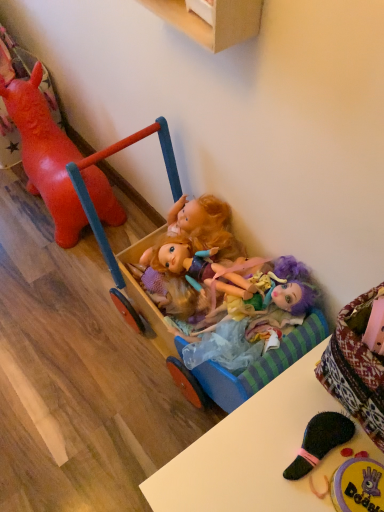
Question: From the image's perspective, is multicolored fabric dolls at center under wooden cabinet at upper center?

Choices:
 (A) yes
 (B) no

Answer: (A)

Question: Can you confirm if multicolored fabric dolls at center is thinner than wooden cabinet at upper center?

Choices:
 (A) yes
 (B) no

Answer: (B)

Question: Can you confirm if multicolored fabric dolls at center is bigger than wooden cabinet at upper center?

Choices:
 (A) no
 (B) yes

Answer: (A)

Question: Is multicolored fabric dolls at center facing away from wooden cabinet at upper center?

Choices:
 (A) no
 (B) yes

Answer: (A)

Question: Is multicolored fabric dolls at center far away from wooden cabinet at upper center?

Choices:
 (A) yes
 (B) no

Answer: (B)

Question: Considering the positions of wooden cabinet at upper center and multicolored fabric dolls at center in the image, is wooden cabinet at upper center taller or shorter than multicolored fabric dolls at center?

Choices:
 (A) short
 (B) tall

Answer: (B)

Question: Do you think wooden cabinet at upper center is within multicolored fabric dolls at center, or outside of it?

Choices:
 (A) inside
 (B) outside

Answer: (B)

Question: Is wooden cabinet at upper center bigger or smaller than multicolored fabric dolls at center?

Choices:
 (A) big
 (B) small

Answer: (A)

Question: Considering the positions of wooden cabinet at upper center and multicolored fabric dolls at center in the image, is wooden cabinet at upper center wider or thinner than multicolored fabric dolls at center?

Choices:
 (A) thin
 (B) wide

Answer: (A)

Question: From the image's perspective, relative to wooden toy carriage at center, is multicolored fabric dolls at center above or below?

Choices:
 (A) above
 (B) below

Answer: (B)

Question: Considering the positions of multicolored fabric dolls at center and wooden toy carriage at center in the image, is multicolored fabric dolls at center wider or thinner than wooden toy carriage at center?

Choices:
 (A) wide
 (B) thin

Answer: (B)

Question: From a real-world perspective, is multicolored fabric dolls at center above or below wooden toy carriage at center?

Choices:
 (A) above
 (B) below

Answer: (A)

Question: In the image, is multicolored fabric dolls at center on the left side or the right side of wooden toy carriage at center?

Choices:
 (A) right
 (B) left

Answer: (A)

Question: In the image, is plush purple doll at lower right, which ranks as the 2th toy in back-to-front order, positioned in front of or behind wooden cabinet at upper center?

Choices:
 (A) front
 (B) behind

Answer: (B)

Question: From a real-world perspective, is plush purple doll at lower right, the 2th toy from the top, physically located above or below wooden cabinet at upper center?

Choices:
 (A) above
 (B) below

Answer: (B)